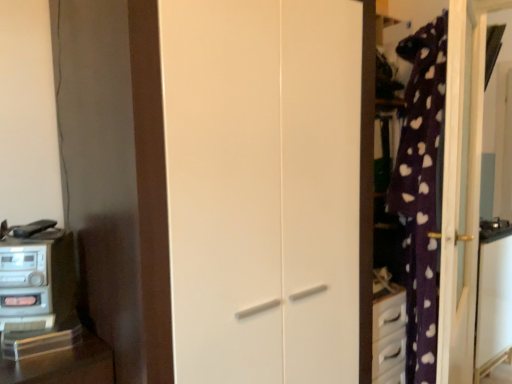
Question: Considering the positions of white matte door at center and metallic silver stereo at left in the image, is white matte door at center taller or shorter than metallic silver stereo at left?

Choices:
 (A) tall
 (B) short

Answer: (A)

Question: Considering their positions, is white matte door at center located in front of or behind metallic silver stereo at left?

Choices:
 (A) behind
 (B) front

Answer: (B)

Question: In the image, is white matte door at center on the left side or the right side of metallic silver stereo at left?

Choices:
 (A) left
 (B) right

Answer: (B)

Question: In the image, is metallic silver stereo at left positioned in front of or behind white matte door at center?

Choices:
 (A) front
 (B) behind

Answer: (B)

Question: Is metallic silver stereo at left bigger or smaller than white matte door at center?

Choices:
 (A) small
 (B) big

Answer: (A)

Question: From a real-world perspective, is metallic silver stereo at left above or below white matte door at center?

Choices:
 (A) above
 (B) below

Answer: (B)

Question: Is metallic silver stereo at left taller or shorter than white matte door at center?

Choices:
 (A) short
 (B) tall

Answer: (A)